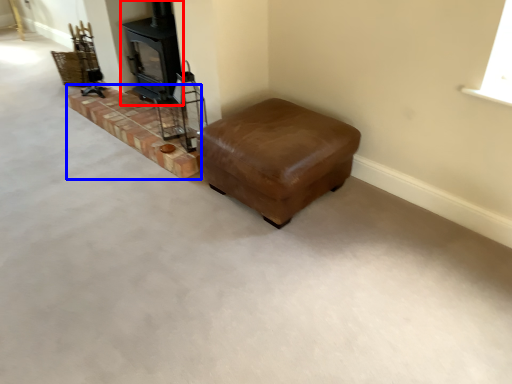
Question: Which object appears farthest to the camera in this image, wood burning stove (highlighted by a red box) or stairwell (highlighted by a blue box)?

Choices:
 (A) wood burning stove
 (B) stairwell

Answer: (A)